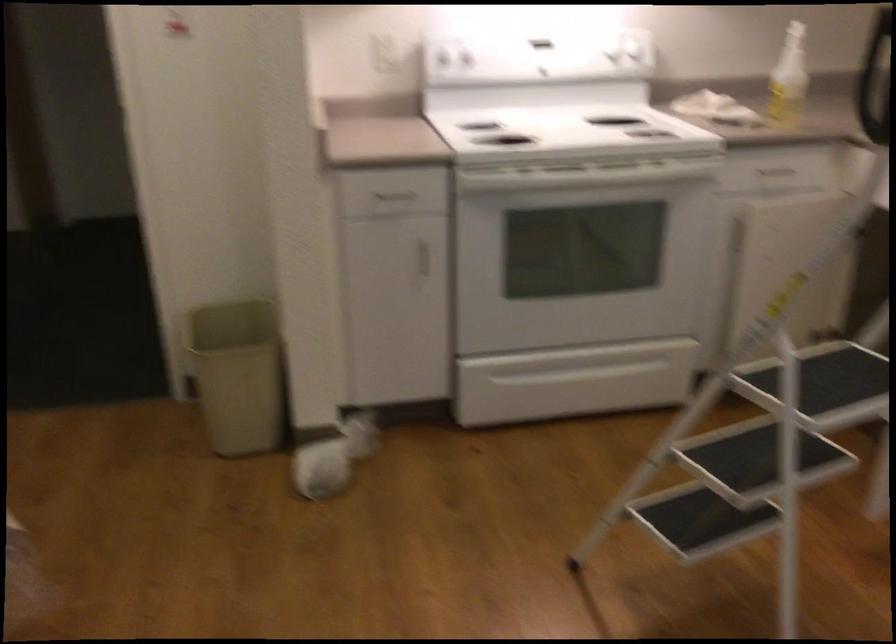
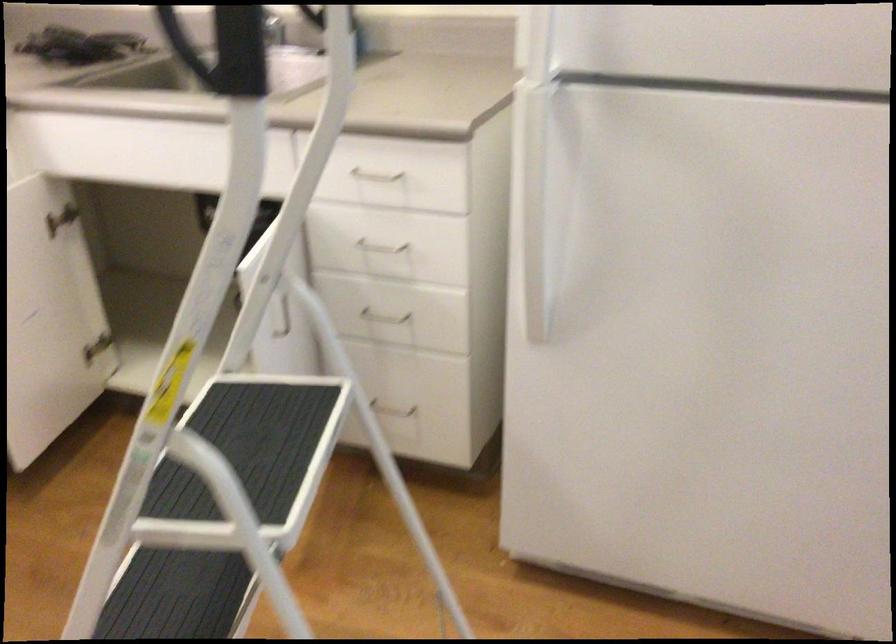
Question: The first image is from the beginning of the video and the second image is from the end. How did the camera likely rotate when shooting the video?

Choices:
 (A) Left
 (B) Right
 (C) Up
 (D) Down

Answer: (B)